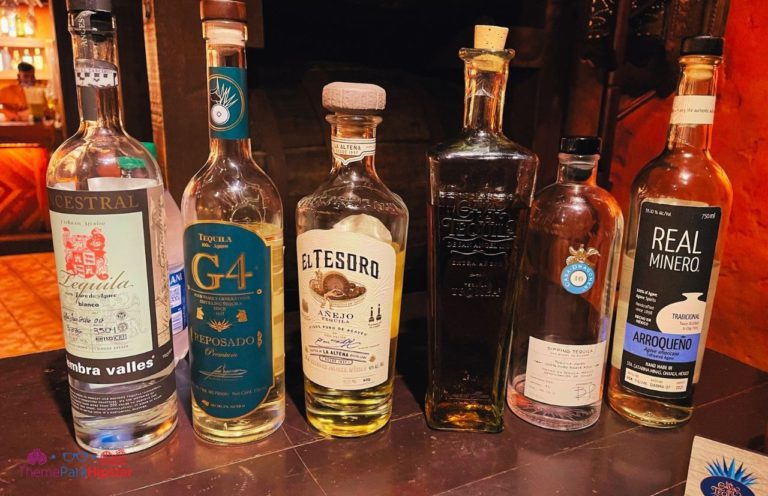
The width and height of the screenshot is (768, 496). In order to click on table in this screenshot , I will do `click(458, 469)`.